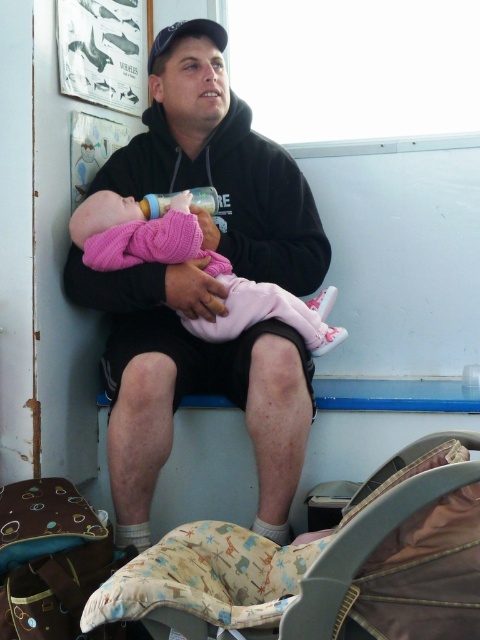
Question: Where is patterned fabric car seat at lower center located in relation to pink knitted baby at center in the image?

Choices:
 (A) right
 (B) left

Answer: (A)

Question: Is patterned fabric car seat at lower center below pink knitted baby at center?

Choices:
 (A) yes
 (B) no

Answer: (A)

Question: Which point is closer to the camera?

Choices:
 (A) (173, 45)
 (B) (171, 232)
 (C) (351, 604)

Answer: (C)

Question: Which of the following is the closest to the observer?

Choices:
 (A) patterned fabric car seat at lower center
 (B) black hoodie at center

Answer: (A)

Question: Which point is closer to the camera?

Choices:
 (A) (167, 35)
 (B) (273, 614)

Answer: (B)

Question: From the image, what is the correct spatial relationship of patterned fabric car seat at lower center in relation to pink knitted baby at center?

Choices:
 (A) left
 (B) right

Answer: (B)